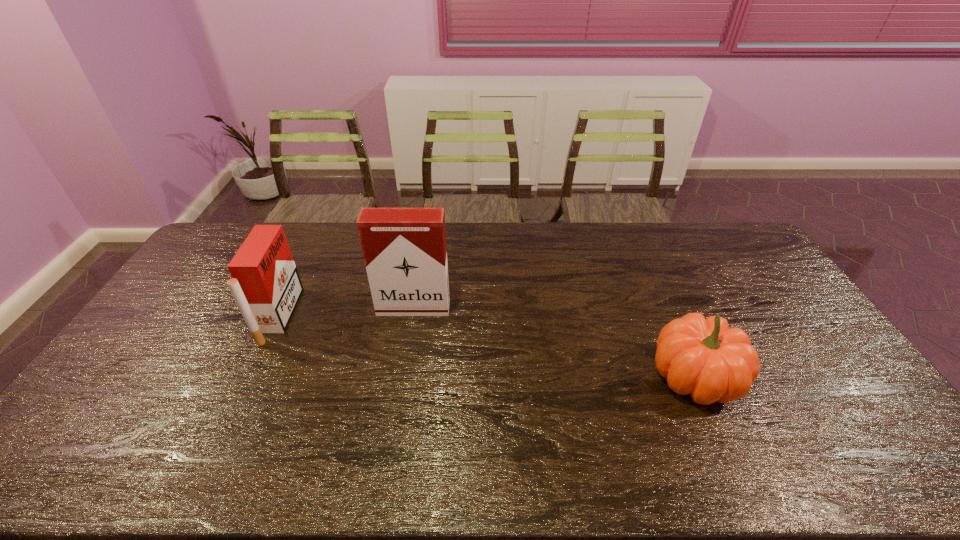
Locate an element on the screen. Image resolution: width=960 pixels, height=540 pixels. vacant space that's between the shortest object and the shorter cigarette case is located at coordinates (487, 346).

At what (x,y) coordinates should I click in order to perform the action: click on unoccupied position between the taller cigarette case and the left cigarette case. Please return your answer as a coordinate pair (x, y). The image size is (960, 540). Looking at the image, I should click on (347, 312).

Where is `vacant space in between the leftmost object and the pumpkin`? vacant space in between the leftmost object and the pumpkin is located at coordinates (487, 346).

Identify the location of vacant area that lies between the tallest object and the left cigarette case. (347, 312).

Choose which object is the nearest neighbor to the taller cigarette case. Please provide its 2D coordinates. Your answer should be formatted as a tuple, i.e. [(x, y)], where the tuple contains the x and y coordinates of a point satisfying the conditions above.

[(265, 284)]

This screenshot has height=540, width=960. Identify the location of the second closest object relative to the shortest object. (265, 284).

Find the location of `free space in the image that satisfies the following two spatial constraints: 1. on the front-facing side of the tallest object; 2. on the front-facing side of the left cigarette case`. free space in the image that satisfies the following two spatial constraints: 1. on the front-facing side of the tallest object; 2. on the front-facing side of the left cigarette case is located at coordinates (412, 316).

You are a GUI agent. You are given a task and a screenshot of the screen. Output one action in this format:
    pyautogui.click(x=<x>, y=<y>)
    Task: Click on the free space that satisfies the following two spatial constraints: 1. on the front-facing side of the leftmost object; 2. on the right side of the rightmost object
    This screenshot has width=960, height=540.
    Given the screenshot: What is the action you would take?
    (x=251, y=377)

You are a GUI agent. You are given a task and a screenshot of the screen. Output one action in this format:
    pyautogui.click(x=<x>, y=<y>)
    Task: Click on the vacant space that satisfies the following two spatial constraints: 1. on the front-facing side of the left cigarette case; 2. on the back side of the shortest object
    The image size is (960, 540).
    Given the screenshot: What is the action you would take?
    pyautogui.click(x=251, y=377)

Identify the location of vacant region that satisfies the following two spatial constraints: 1. on the front-facing side of the shortest object; 2. on the right side of the tallest object. This screenshot has width=960, height=540. (402, 377).